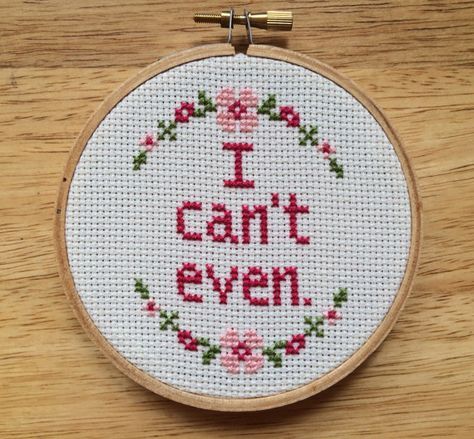
Find the location of `cross-stitched letters`. cross-stitched letters is located at coordinates (296, 276), (255, 286), (225, 292), (188, 277), (293, 209), (264, 229), (228, 237), (191, 237), (239, 179).